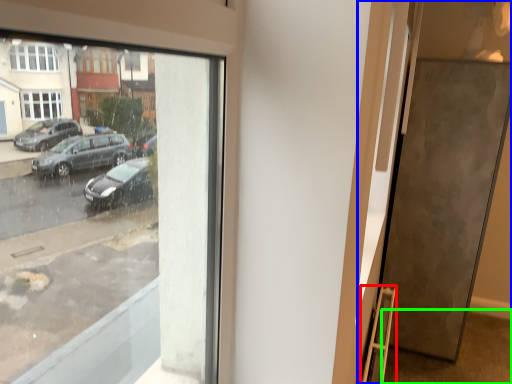
Question: Which object is positioned closest to ladder (highlighted by a red box)? Select from door (highlighted by a blue box) and pavement (highlighted by a green box).

Choices:
 (A) door
 (B) pavement

Answer: (A)